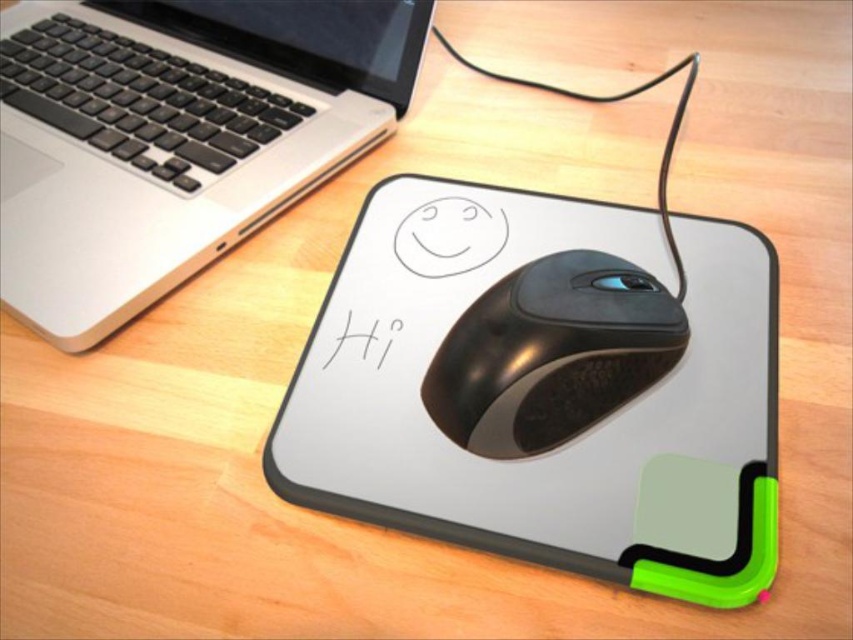
Is satin silver laptop at upper left positioned before black matte mouse at center?

No, it is not.

Between satin silver laptop at upper left and black matte mouse at center, which one is positioned higher?

satin silver laptop at upper left is higher up.

The height and width of the screenshot is (640, 853). What do you see at coordinates (175, 136) in the screenshot?
I see `satin silver laptop at upper left` at bounding box center [175, 136].

This screenshot has height=640, width=853. What are the coordinates of `satin silver laptop at upper left` in the screenshot? It's located at (175, 136).

Which of these two, white matte mousepad at center or black matte mouse at center, stands taller?

With more height is white matte mousepad at center.

Is white matte mousepad at center positioned at the back of black matte mouse at center?

No.

Identify the location of white matte mousepad at center. (546, 387).

Describe the element at coordinates (546, 387) in the screenshot. I see `white matte mousepad at center` at that location.

Identify the location of white matte mousepad at center. (546, 387).